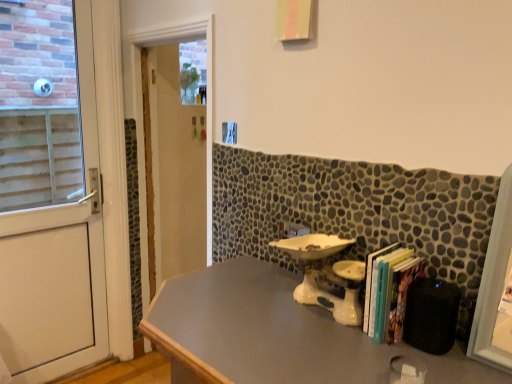
Question: Considering the relative sizes of white glossy door at center and hardcover books at right in the image provided, is white glossy door at center smaller than hardcover books at right?

Choices:
 (A) no
 (B) yes

Answer: (A)

Question: Is white glossy door at center far away from hardcover books at right?

Choices:
 (A) no
 (B) yes

Answer: (B)

Question: Is hardcover books at right a part of white glossy door at center?

Choices:
 (A) no
 (B) yes

Answer: (A)

Question: From a real-world perspective, is white glossy door at center physically above hardcover books at right?

Choices:
 (A) yes
 (B) no

Answer: (B)

Question: Is white glossy door at center positioned in front of hardcover books at right?

Choices:
 (A) yes
 (B) no

Answer: (B)

Question: From a real-world perspective, is white glossy door at center below hardcover books at right?

Choices:
 (A) yes
 (B) no

Answer: (A)

Question: Is white matte door at left positioned behind hardcover books at right?

Choices:
 (A) no
 (B) yes

Answer: (B)

Question: Is white matte door at left oriented away from hardcover books at right?

Choices:
 (A) yes
 (B) no

Answer: (B)

Question: Considering the relative sizes of white matte door at left and hardcover books at right in the image provided, is white matte door at left wider than hardcover books at right?

Choices:
 (A) yes
 (B) no

Answer: (B)

Question: Can hardcover books at right be found inside white matte door at left?

Choices:
 (A) no
 (B) yes

Answer: (A)

Question: From the image's perspective, is white matte door at left located beneath hardcover books at right?

Choices:
 (A) no
 (B) yes

Answer: (A)

Question: Does white matte door at left have a lesser width compared to hardcover books at right?

Choices:
 (A) yes
 (B) no

Answer: (A)

Question: Is white matte door at left shorter than white glossy door at center?

Choices:
 (A) no
 (B) yes

Answer: (A)